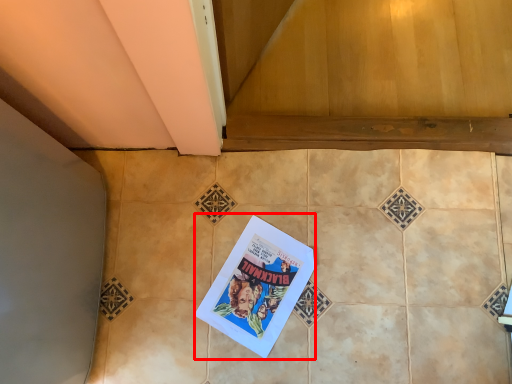
Question: From the image, what is the correct spatial relationship of comic book (annotated by the red box) in relation to ceramic tile?

Choices:
 (A) left
 (B) right

Answer: (A)